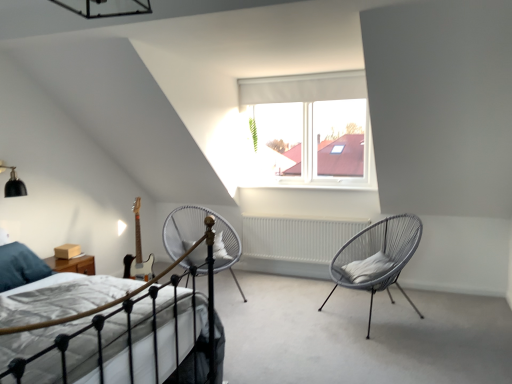
Question: Is silver metallic chair at center, placed as the second chair when sorted from right to left, positioned in front of white soft pillow at right?

Choices:
 (A) no
 (B) yes

Answer: (A)

Question: Does silver metallic chair at center, placed as the second chair when sorted from right to left, have a smaller size compared to white soft pillow at right?

Choices:
 (A) no
 (B) yes

Answer: (A)

Question: Considering the relative sizes of silver metallic chair at center, placed as the second chair when sorted from right to left, and white soft pillow at right in the image provided, is silver metallic chair at center, placed as the second chair when sorted from right to left, thinner than white soft pillow at right?

Choices:
 (A) yes
 (B) no

Answer: (B)

Question: Is silver metallic chair at center, placed as the second chair when sorted from right to left, at the right side of white soft pillow at right?

Choices:
 (A) no
 (B) yes

Answer: (A)

Question: From the image's perspective, is silver metallic chair at center, placed as the second chair when sorted from right to left, below white soft pillow at right?

Choices:
 (A) no
 (B) yes

Answer: (A)

Question: Is point (380, 269) closer or farther from the camera than point (374, 289)?

Choices:
 (A) farther
 (B) closer

Answer: (A)

Question: Considering the relative positions of white soft pillow at right and gray woven chair at right, which is counted as the 2th chair, starting from the left, in the image provided, is white soft pillow at right to the left or to the right of gray woven chair at right, which is counted as the 2th chair, starting from the left,?

Choices:
 (A) right
 (B) left

Answer: (B)

Question: From a real-world perspective, is white soft pillow at right positioned above or below gray woven chair at right, which is counted as the 2th chair, starting from the left?

Choices:
 (A) above
 (B) below

Answer: (A)

Question: From the image's perspective, relative to gray woven chair at right, which is counted as the 2th chair, starting from the left, is white soft pillow at right above or below?

Choices:
 (A) above
 (B) below

Answer: (A)

Question: From a real-world perspective, is white fabric bed at lower left above or below white soft pillow at right?

Choices:
 (A) below
 (B) above

Answer: (A)

Question: Is white fabric bed at lower left wider or thinner than white soft pillow at right?

Choices:
 (A) wide
 (B) thin

Answer: (A)

Question: Would you say white fabric bed at lower left is inside or outside white soft pillow at right?

Choices:
 (A) outside
 (B) inside

Answer: (A)

Question: Considering the positions of point (76, 327) and point (373, 264), is point (76, 327) closer or farther from the camera than point (373, 264)?

Choices:
 (A) farther
 (B) closer

Answer: (B)

Question: In terms of height, does white fabric bed at lower left look taller or shorter compared to silver metallic chair at center, which is counted as the 1th chair, starting from the left?

Choices:
 (A) tall
 (B) short

Answer: (B)

Question: Looking at their shapes, would you say white fabric bed at lower left is wider or thinner than silver metallic chair at center, placed as the second chair when sorted from right to left?

Choices:
 (A) wide
 (B) thin

Answer: (A)